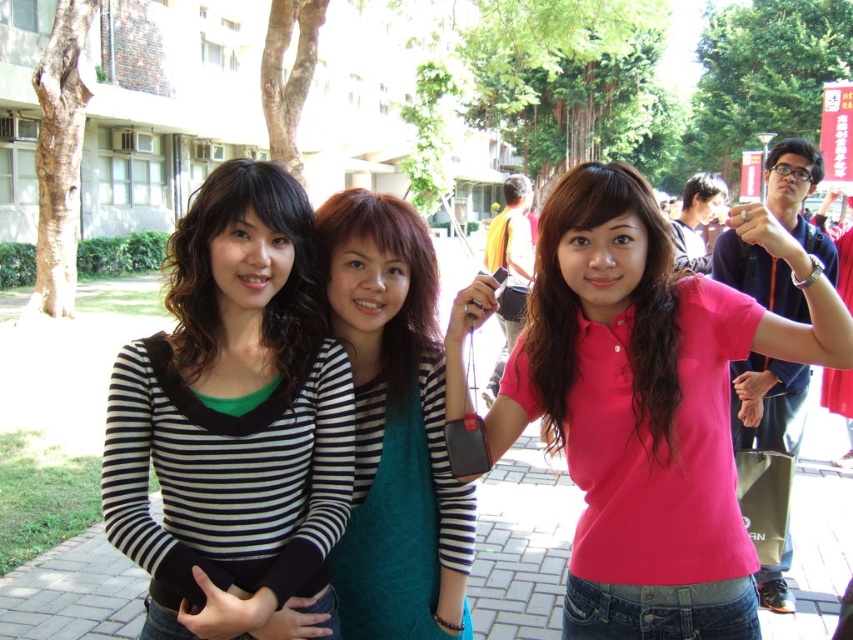
The image size is (853, 640). What do you see at coordinates (393, 426) in the screenshot? I see `striped fabric shirt at center` at bounding box center [393, 426].

Does point (419, 579) come closer to viewer compared to point (788, 556)?

Yes, it is.

At what (x,y) coordinates should I click in order to perform the action: click on striped fabric shirt at center. Please return your answer as a coordinate pair (x, y). Looking at the image, I should click on (393, 426).

Where is `pink matte shirt at center`? The height and width of the screenshot is (640, 853). pink matte shirt at center is located at coordinates (648, 404).

The image size is (853, 640). What are the coordinates of `pink matte shirt at center` in the screenshot? It's located at (648, 404).

Who is more forward, (613, 397) or (791, 220)?

Point (613, 397)

Between pink matte shirt at center and pink matte shirt at upper right, which one appears on the right side from the viewer's perspective?

pink matte shirt at upper right is more to the right.

At what (x,y) coordinates should I click in order to perform the action: click on pink matte shirt at center. Please return your answer as a coordinate pair (x, y). This screenshot has width=853, height=640. Looking at the image, I should click on (648, 404).